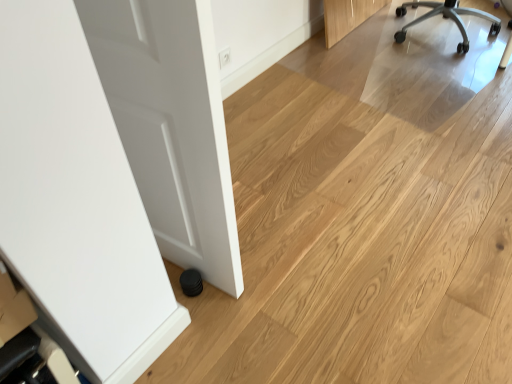
Question: Is silver metallic chair at upper right at the right side of white glossy door at left?

Choices:
 (A) yes
 (B) no

Answer: (A)

Question: From the image's perspective, is silver metallic chair at upper right located beneath white glossy door at left?

Choices:
 (A) yes
 (B) no

Answer: (B)

Question: Does silver metallic chair at upper right come behind white glossy door at left?

Choices:
 (A) yes
 (B) no

Answer: (A)

Question: Considering the relative sizes of silver metallic chair at upper right and white glossy door at left in the image provided, is silver metallic chair at upper right thinner than white glossy door at left?

Choices:
 (A) no
 (B) yes

Answer: (A)

Question: Is silver metallic chair at upper right turned away from white glossy door at left?

Choices:
 (A) no
 (B) yes

Answer: (A)

Question: From a real-world perspective, is silver metallic chair at upper right physically above white glossy door at left?

Choices:
 (A) no
 (B) yes

Answer: (A)

Question: From a real-world perspective, is white glossy door at left physically below silver metallic chair at upper right?

Choices:
 (A) no
 (B) yes

Answer: (A)

Question: Can you confirm if white glossy door at left is thinner than silver metallic chair at upper right?

Choices:
 (A) no
 (B) yes

Answer: (B)

Question: Is white glossy door at left oriented towards silver metallic chair at upper right?

Choices:
 (A) yes
 (B) no

Answer: (A)

Question: Does white glossy door at left have a greater height compared to silver metallic chair at upper right?

Choices:
 (A) yes
 (B) no

Answer: (A)

Question: Would you say white glossy door at left is outside silver metallic chair at upper right?

Choices:
 (A) no
 (B) yes

Answer: (B)

Question: Does white glossy door at left lie in front of silver metallic chair at upper right?

Choices:
 (A) no
 (B) yes

Answer: (B)

Question: Is silver metallic chair at upper right wider or thinner than white glossy door at left?

Choices:
 (A) thin
 (B) wide

Answer: (B)